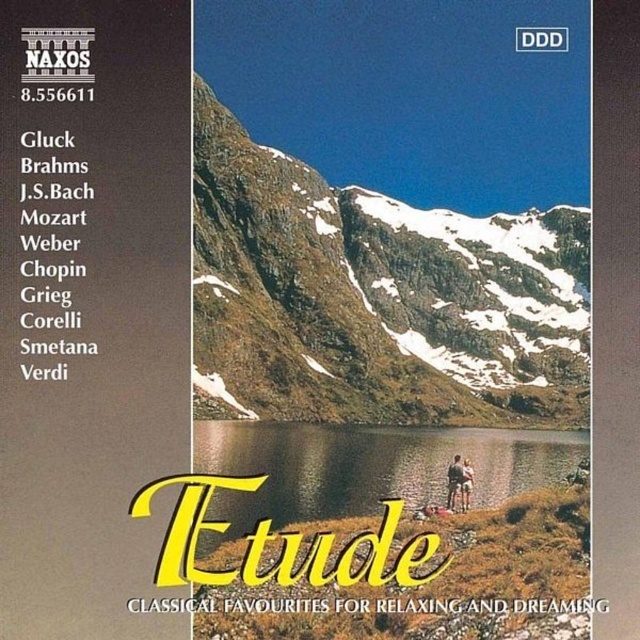
Question: Which point is closer to the camera?

Choices:
 (A) (189, 362)
 (B) (380, 280)

Answer: (A)

Question: Can you confirm if snowy rock mountain at center is smaller than brown leather jacket at lower center?

Choices:
 (A) yes
 (B) no

Answer: (B)

Question: Which object appears farthest from the camera in this image?

Choices:
 (A) snowy rock mountain at center
 (B) transparent water at center
 (C) light brown leather jacket at lower right
 (D) brown leather jacket at lower center

Answer: (A)

Question: Does transparent water at center appear on the right side of light brown leather jacket at lower right?

Choices:
 (A) no
 (B) yes

Answer: (A)

Question: Which object appears closest to the camera in this image?

Choices:
 (A) snowy rock mountain at center
 (B) brown leather jacket at lower center
 (C) transparent water at center
 (D) matte black text at upper left

Answer: (D)

Question: Can you confirm if snowy rock mountain at center is wider than light brown leather jacket at lower right?

Choices:
 (A) yes
 (B) no

Answer: (A)